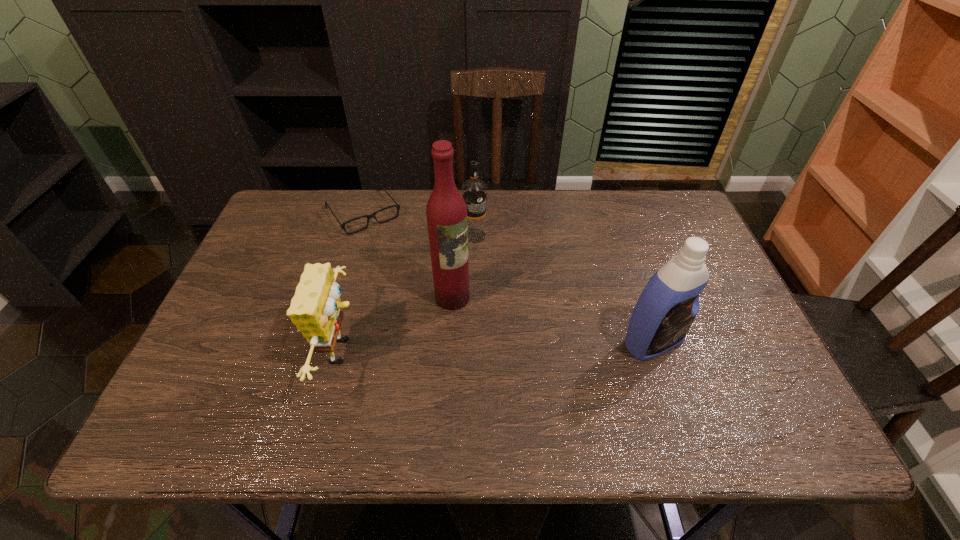
Where is `vacant space that satisfies the following two spatial constraints: 1. on the front side of the shortest object; 2. on the face of the sponge`? vacant space that satisfies the following two spatial constraints: 1. on the front side of the shortest object; 2. on the face of the sponge is located at coordinates (322, 351).

I want to click on free location that satisfies the following two spatial constraints: 1. on the front side of the shortest object; 2. on the left side of the fourth shortest object, so click(324, 342).

This screenshot has height=540, width=960. Find the location of `vacant space that satisfies the following two spatial constraints: 1. on the front side of the vodka; 2. on the left side of the spectacles`. vacant space that satisfies the following two spatial constraints: 1. on the front side of the vodka; 2. on the left side of the spectacles is located at coordinates (356, 235).